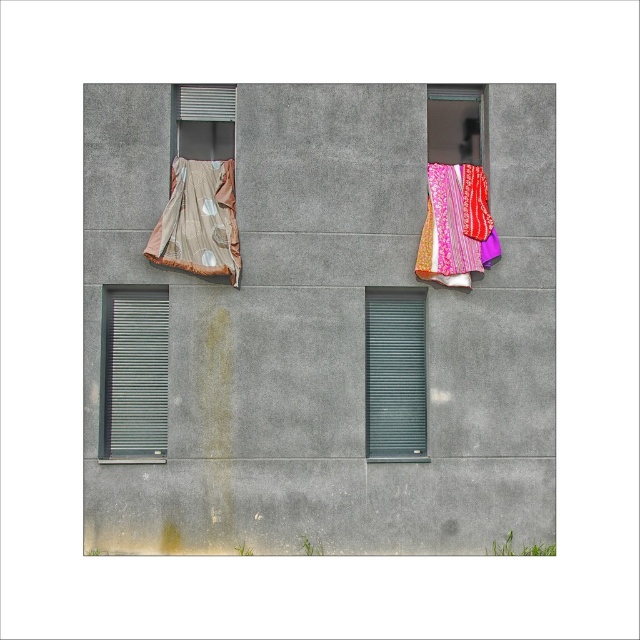
Is point (115, 356) more distant than point (170, 230)?

Yes, point (115, 356) is farther from viewer.

Can you confirm if matte gray shutter at left is positioned below shiny metallic curtain at upper left?

Indeed, matte gray shutter at left is positioned under shiny metallic curtain at upper left.

Who is more forward, (122, 291) or (150, 237)?

Point (150, 237) is in front.

Locate an element on the screen. This screenshot has height=640, width=640. matte gray shutter at left is located at coordinates (132, 372).

Which is in front, point (140, 417) or point (410, 330)?

Positioned in front is point (140, 417).

The image size is (640, 640). Describe the element at coordinates (312, 328) in the screenshot. I see `textured concrete wall at center` at that location.

Locate an element on the screen. This screenshot has height=640, width=640. textured concrete wall at center is located at coordinates (312, 328).

Looking at this image, is textured concrete wall at center to the right of shiny metallic curtain at upper left from the viewer's perspective?

Correct, you'll find textured concrete wall at center to the right of shiny metallic curtain at upper left.

Does point (394, 474) come behind point (176, 186)?

No, it is in front of (176, 186).

The image size is (640, 640). I want to click on textured concrete wall at center, so pyautogui.click(x=312, y=328).